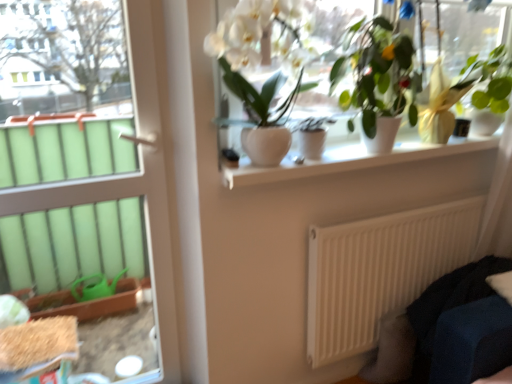
Question: Is matte white pot at center, the second houseplant in the left-to-right sequence, inside white glossy window sill at upper center?

Choices:
 (A) yes
 (B) no

Answer: (B)

Question: Is white glossy window sill at upper center wider than matte white pot at center, the second houseplant in the left-to-right sequence?

Choices:
 (A) no
 (B) yes

Answer: (B)

Question: Is white glossy window sill at upper center to the right of matte white pot at center, the second houseplant in the left-to-right sequence, from the viewer's perspective?

Choices:
 (A) yes
 (B) no

Answer: (A)

Question: Is matte white pot at center, acting as the 3th houseplant starting from the right, at the back of white glossy window sill at upper center?

Choices:
 (A) no
 (B) yes

Answer: (A)

Question: From a real-world perspective, is white glossy window sill at upper center beneath matte white pot at center, acting as the 3th houseplant starting from the right?

Choices:
 (A) yes
 (B) no

Answer: (A)

Question: Considering the positions of point (472, 271) and point (482, 104), is point (472, 271) closer or farther from the camera than point (482, 104)?

Choices:
 (A) farther
 (B) closer

Answer: (A)

Question: In terms of width, does dark blue fabric couch at lower right look wider or thinner when compared to green glossy plant at upper right, marked as the fourth houseplant in a left-to-right arrangement?

Choices:
 (A) thin
 (B) wide

Answer: (B)

Question: From a real-world perspective, is dark blue fabric couch at lower right above or below green glossy plant at upper right, arranged as the first houseplant when viewed from the right?

Choices:
 (A) below
 (B) above

Answer: (A)

Question: Based on their positions, is dark blue fabric couch at lower right located to the left or right of green glossy plant at upper right, arranged as the first houseplant when viewed from the right?

Choices:
 (A) right
 (B) left

Answer: (A)

Question: Relative to white matte radiator at lower right, is matte white pot at center, acting as the 3th houseplant starting from the right, in front or behind?

Choices:
 (A) behind
 (B) front

Answer: (B)

Question: Is matte white pot at center, the second houseplant in the left-to-right sequence, to the left or to the right of white matte radiator at lower right in the image?

Choices:
 (A) left
 (B) right

Answer: (A)

Question: In terms of size, does matte white pot at center, the second houseplant in the left-to-right sequence, appear bigger or smaller than white matte radiator at lower right?

Choices:
 (A) small
 (B) big

Answer: (A)

Question: From the image's perspective, is matte white pot at center, the second houseplant in the left-to-right sequence, located above or below white matte radiator at lower right?

Choices:
 (A) below
 (B) above

Answer: (B)

Question: Considering the relative positions of white glossy door at left and matte white pot at center, acting as the 3th houseplant starting from the right, in the image provided, is white glossy door at left to the left or to the right of matte white pot at center, acting as the 3th houseplant starting from the right,?

Choices:
 (A) left
 (B) right

Answer: (A)

Question: Relative to matte white pot at center, the second houseplant in the left-to-right sequence, is white glossy door at left in front or behind?

Choices:
 (A) behind
 (B) front

Answer: (B)